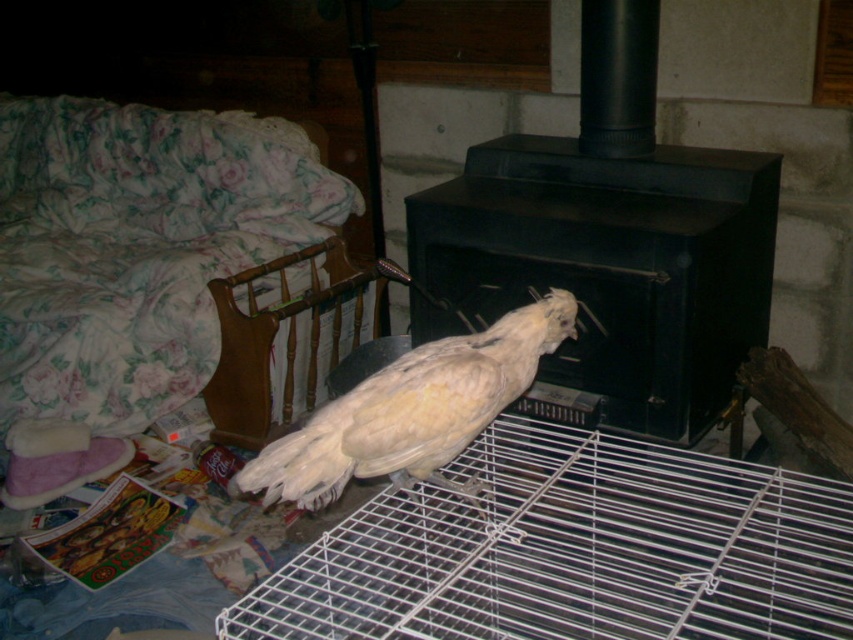
Question: Estimate the real-world distances between objects in this image. Which object is closer to the black matte fireplace at center?

Choices:
 (A) white feathered bird at center
 (B) white wire cage at center

Answer: (B)

Question: Can you confirm if white wire cage at center is positioned to the right of black matte fireplace at center?

Choices:
 (A) no
 (B) yes

Answer: (A)

Question: Is white wire cage at center further to camera compared to white feathered bird at center?

Choices:
 (A) no
 (B) yes

Answer: (A)

Question: Which point is farther to the camera?

Choices:
 (A) white feathered bird at center
 (B) black matte fireplace at center

Answer: (B)

Question: Is white wire cage at center smaller than black matte fireplace at center?

Choices:
 (A) no
 (B) yes

Answer: (A)

Question: Among these objects, which one is nearest to the camera?

Choices:
 (A) white feathered bird at center
 (B) black matte fireplace at center
 (C) white wire cage at center

Answer: (C)